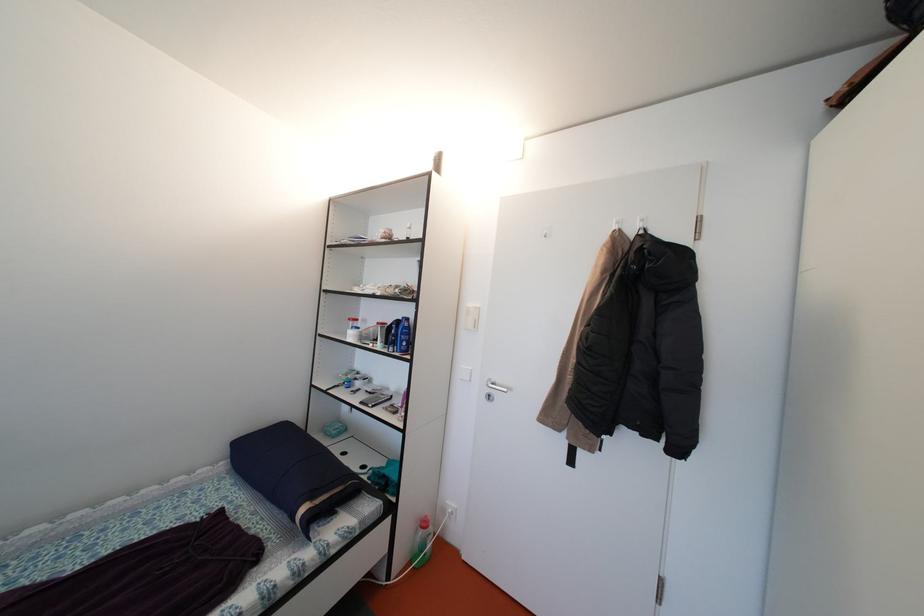
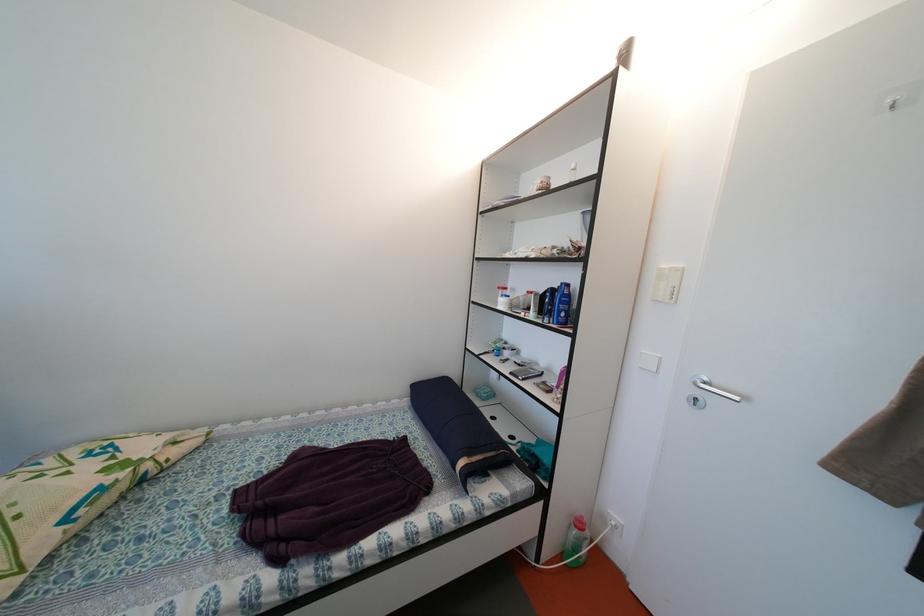
Locate, in the second image, the point that corresponds to [357,323] in the first image.

(505, 293)